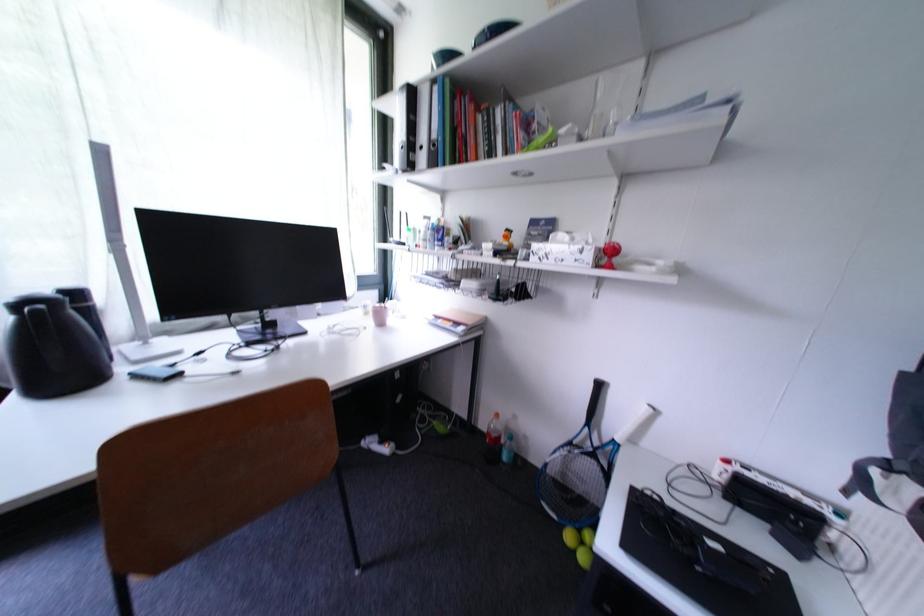
Where is `pink coffee cup`? pink coffee cup is located at coordinates (379, 314).